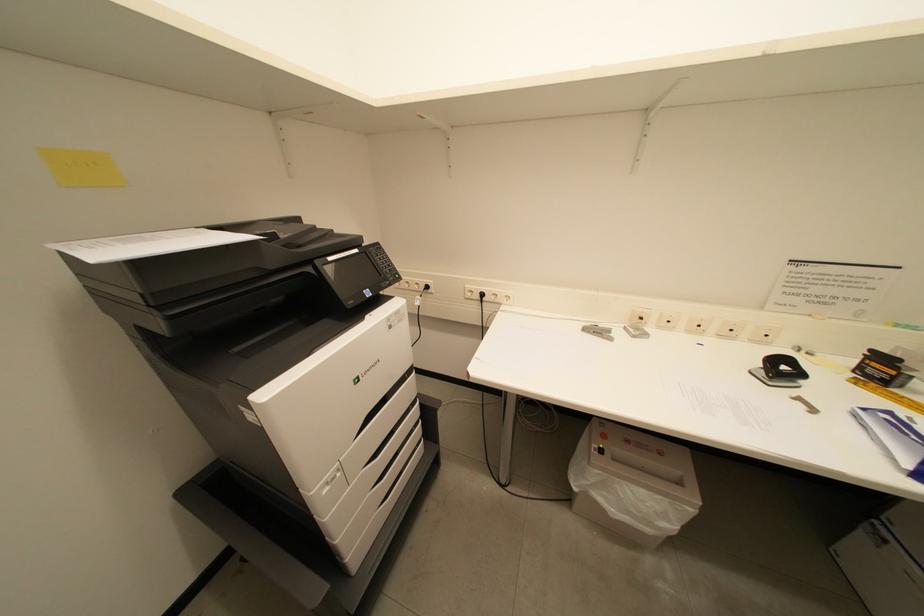
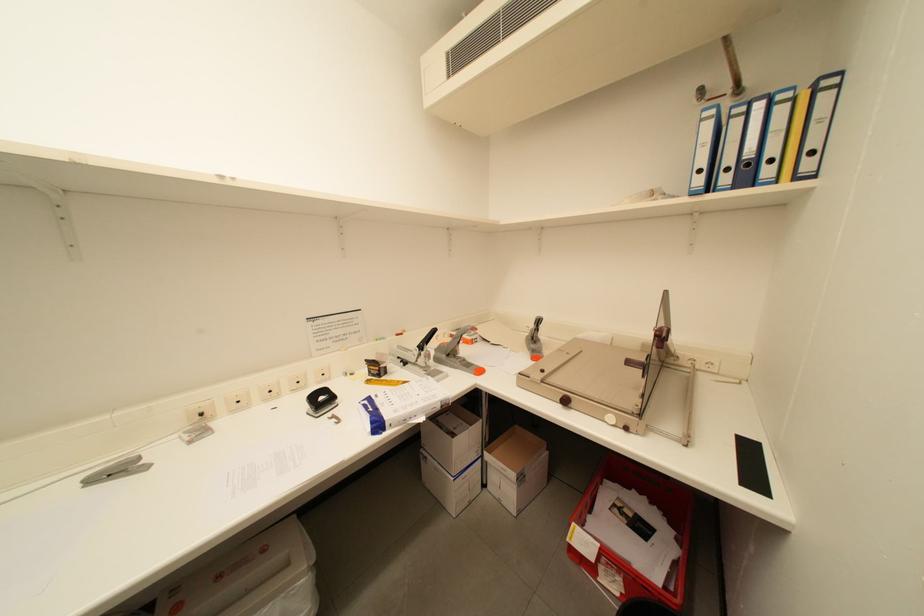
Question: The camera is either moving clockwise (left) or counter-clockwise (right) around the object. The first image is from the beginning of the video and the second image is from the end. Is the camera moving left or right when shooting the video?

Choices:
 (A) Left
 (B) Right

Answer: (A)